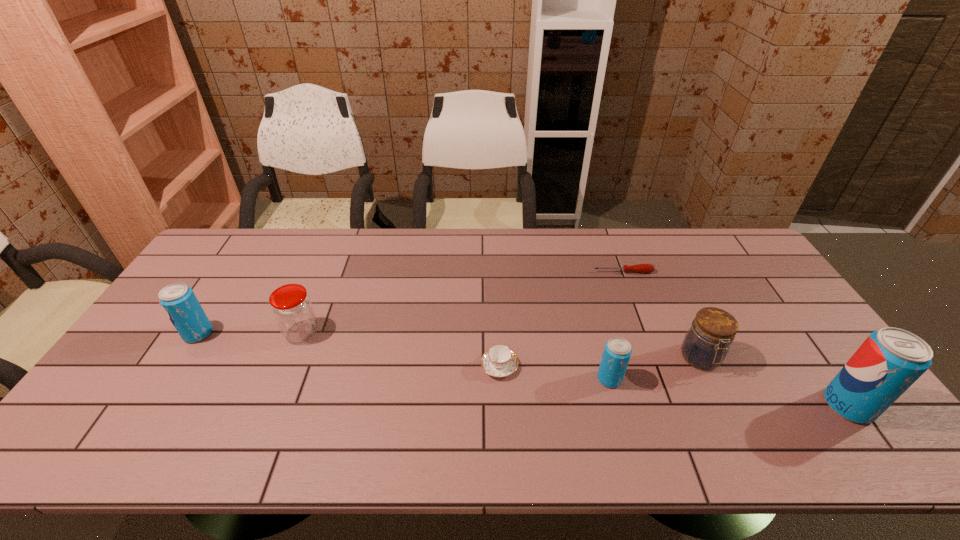
At what (x,y) coordinates should I click in order to perform the action: click on the leftmost soda can. Please return your answer as a coordinate pair (x, y). Looking at the image, I should click on (178, 300).

Find the location of a particular element. This screenshot has height=540, width=960. the leftmost object is located at coordinates (178, 300).

Locate an element on the screen. the fourth object from right to left is located at coordinates (617, 351).

At what (x,y) coordinates should I click in order to perform the action: click on the shortest soda can. Please return your answer as a coordinate pair (x, y). This screenshot has width=960, height=540. Looking at the image, I should click on (617, 351).

Locate an element on the screen. This screenshot has height=540, width=960. the tallest soda can is located at coordinates (890, 360).

I want to click on the rightmost object, so (x=890, y=360).

I want to click on the shortest object, so click(x=642, y=268).

This screenshot has width=960, height=540. Find the location of `the farthest object`. the farthest object is located at coordinates (642, 268).

Where is `the right jar`? This screenshot has width=960, height=540. the right jar is located at coordinates (706, 344).

This screenshot has width=960, height=540. Identify the location of the left jar. (291, 306).